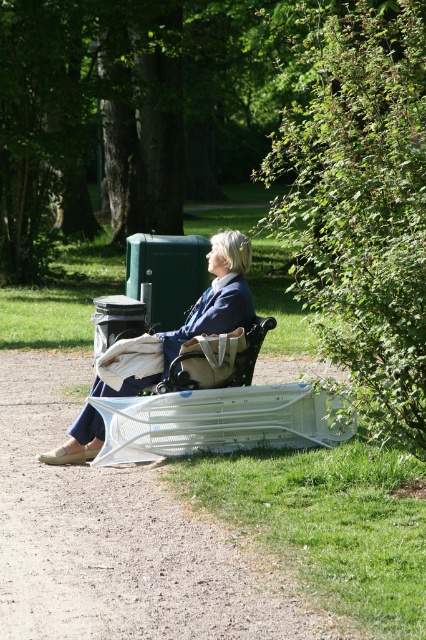
In the scene shown: Does white plastic bench at lower center have a greater height compared to green leafy bush at right?

Incorrect, white plastic bench at lower center's height is not larger of green leafy bush at right's.

Consider the image. Does white plastic bench at lower center have a lesser width compared to green leafy bush at right?

Yes, white plastic bench at lower center is thinner than green leafy bush at right.

At what (x,y) coordinates should I click in order to perform the action: click on white plastic bench at lower center. Please return your answer as a coordinate pair (x, y). This screenshot has height=640, width=426. Looking at the image, I should click on (120, 538).

From the picture: Can you confirm if green leafy bush at right is smaller than wooden textured chair at center?

Incorrect, green leafy bush at right is not smaller in size than wooden textured chair at center.

You are a GUI agent. You are given a task and a screenshot of the screen. Output one action in this format:
    pyautogui.click(x=<x>, y=<y>)
    Task: Click on the green leafy bush at right
    
    Given the screenshot: What is the action you would take?
    [x=362, y=204]

Can you confirm if white plastic bench at lower center is thinner than wooden textured chair at center?

Indeed, white plastic bench at lower center has a lesser width compared to wooden textured chair at center.

What are the coordinates of `white plastic bench at lower center` in the screenshot? It's located at (120, 538).

Who is more distant from viewer, [2,440] or [252,333]?

Point [2,440]

Find the location of a particular element. This screenshot has height=640, width=426. white plastic bench at lower center is located at coordinates (120, 538).